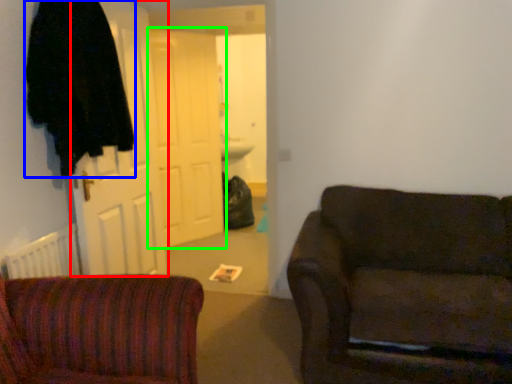
Question: Considering the real-world distances, which object is closest to door (highlighted by a red box)? robe (highlighted by a blue box) or door (highlighted by a green box).

Choices:
 (A) robe
 (B) door

Answer: (A)